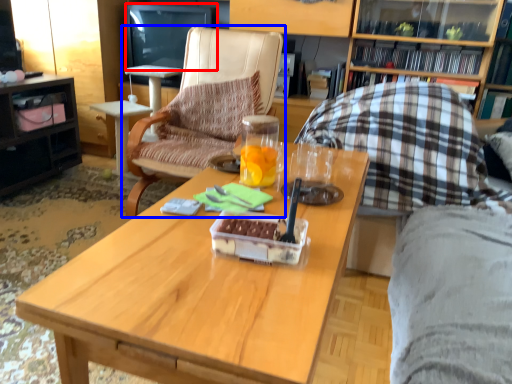
Question: Which point is further to the camera, television (highlighted by a red box) or chair (highlighted by a blue box)?

Choices:
 (A) television
 (B) chair

Answer: (A)